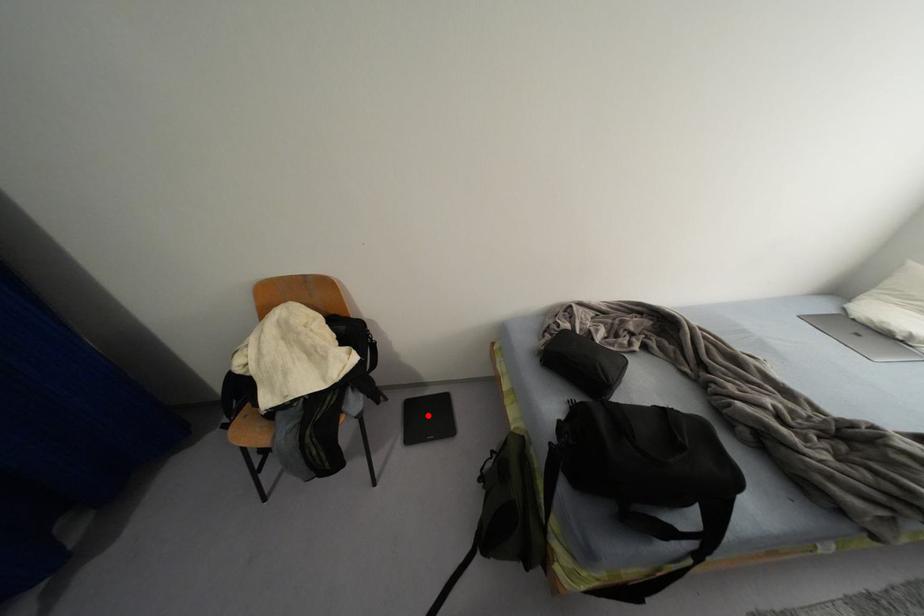
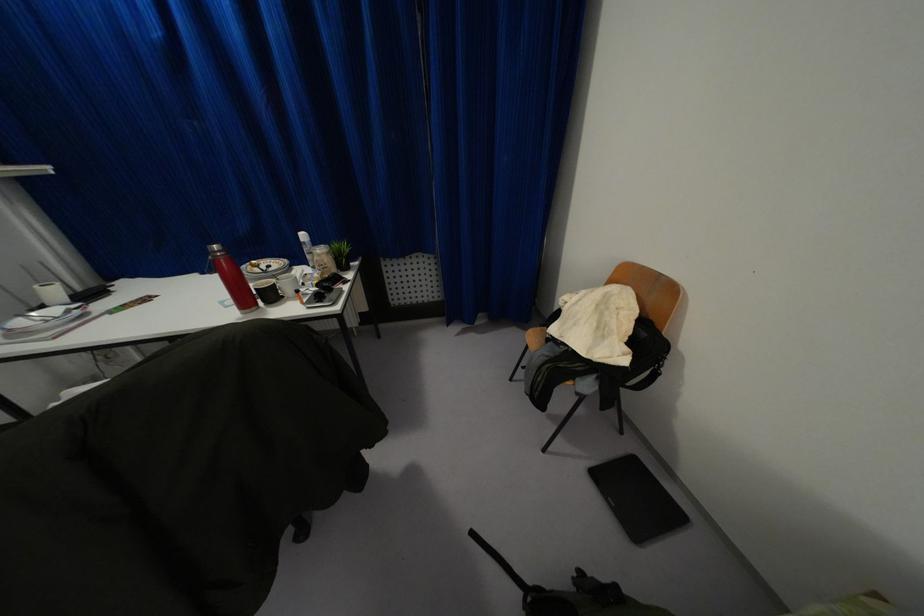
Question: I am providing you with two images of the same scene from different viewpoints. Image1 has a red point marked. In image2, the corresponding 3D location appears at what relative position? Reply with the corresponding letter.

Choices:
 (A) Closer
 (B) Farther

Answer: (A)